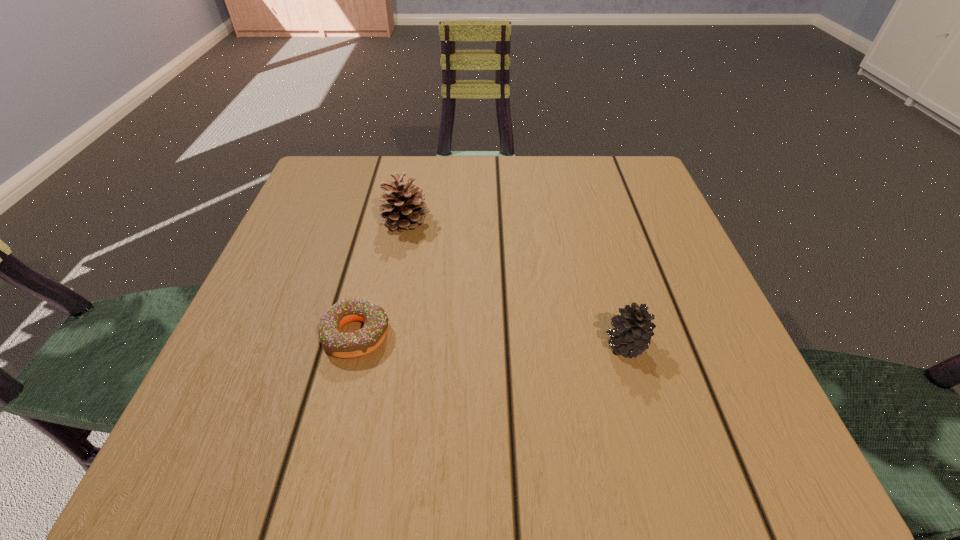
I want to click on vacant space that satisfies the following two spatial constraints: 1. on the back side of the left pinecone; 2. on the left side of the shortest object, so click(x=384, y=221).

This screenshot has width=960, height=540. Find the location of `free spot that satisfies the following two spatial constraints: 1. on the back side of the doughnut; 2. on the right side of the farther pinecone`. free spot that satisfies the following two spatial constraints: 1. on the back side of the doughnut; 2. on the right side of the farther pinecone is located at coordinates (384, 221).

Locate an element on the screen. free location that satisfies the following two spatial constraints: 1. on the front side of the second shortest object; 2. on the right side of the tallest object is located at coordinates pos(382,344).

Locate an element on the screen. vacant region that satisfies the following two spatial constraints: 1. on the back side of the farthest object; 2. on the right side of the shortest object is located at coordinates (384, 221).